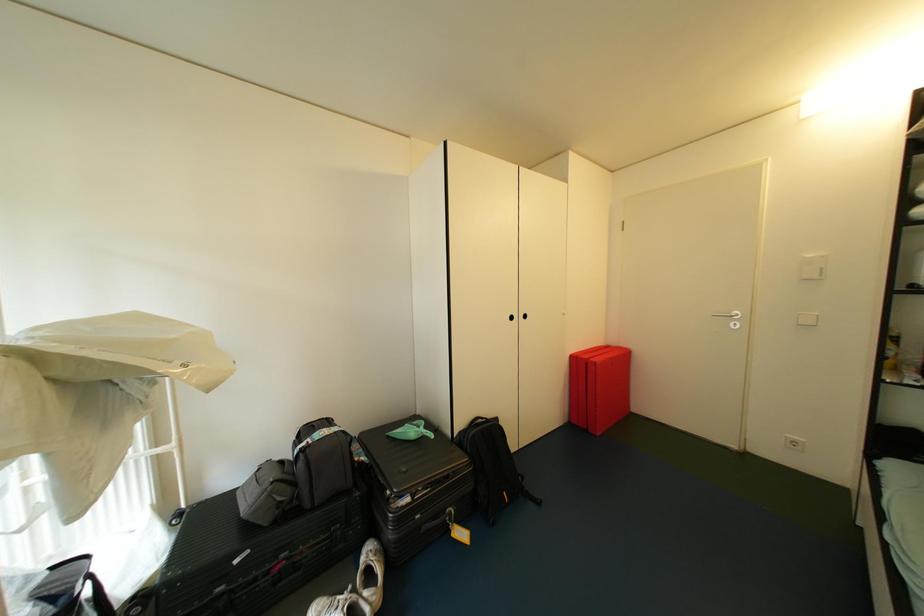
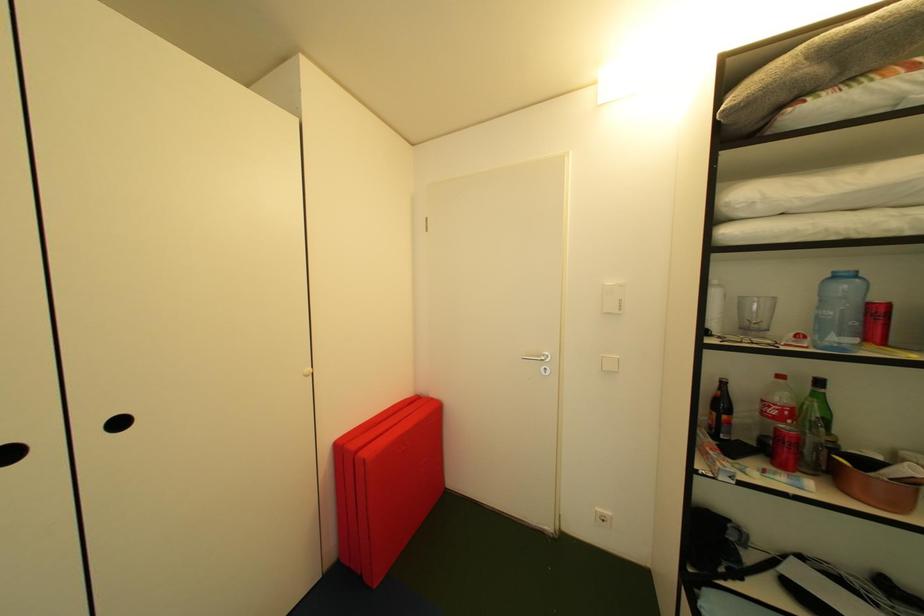
In a continuous first-person perspective shot, in which direction is the camera moving?

The cameraman walked toward right, forward.